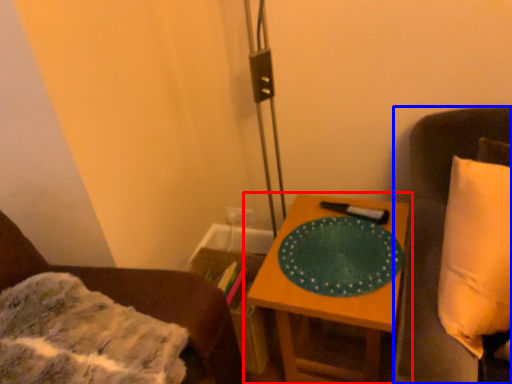
Question: Which point is further to the camera, table (highlighted by a red box) or furniture (highlighted by a blue box)?

Choices:
 (A) table
 (B) furniture

Answer: (A)